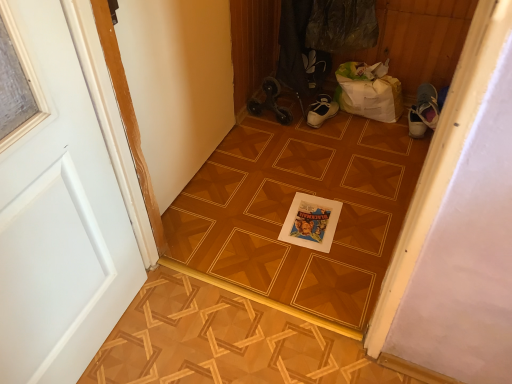
Question: From the image's perspective, is white painted wood door at left located above or below wooden parquet floor at center?

Choices:
 (A) below
 (B) above

Answer: (A)

Question: From a real-world perspective, relative to wooden parquet floor at center, is white painted wood door at left vertically above or below?

Choices:
 (A) above
 (B) below

Answer: (A)

Question: Considering the real-world distances, which object is farthest from the white painted wood door at left?

Choices:
 (A) wooden parquet floor at center
 (B) wooden parquet floor at center

Answer: (A)

Question: Based on their relative distances, which object is farther from the wooden parquet floor at center?

Choices:
 (A) white painted wood door at left
 (B) wooden parquet floor at center

Answer: (A)